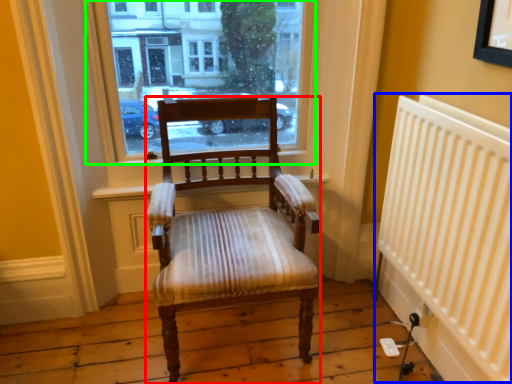
Question: Which object is the closest to the chair (highlighted by a red box)? Choose among these: radiator (highlighted by a blue box) or window (highlighted by a green box).

Choices:
 (A) radiator
 (B) window

Answer: (B)